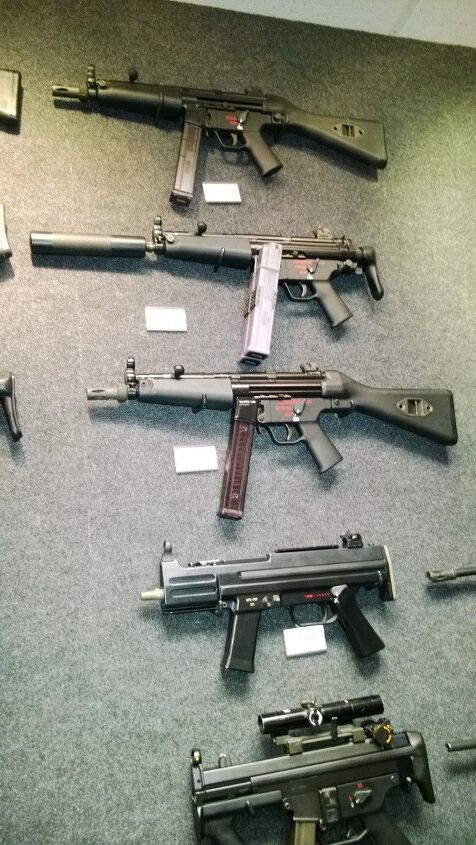
Locate an element on the screen. This screenshot has height=845, width=476. floor is located at coordinates (91, 491).